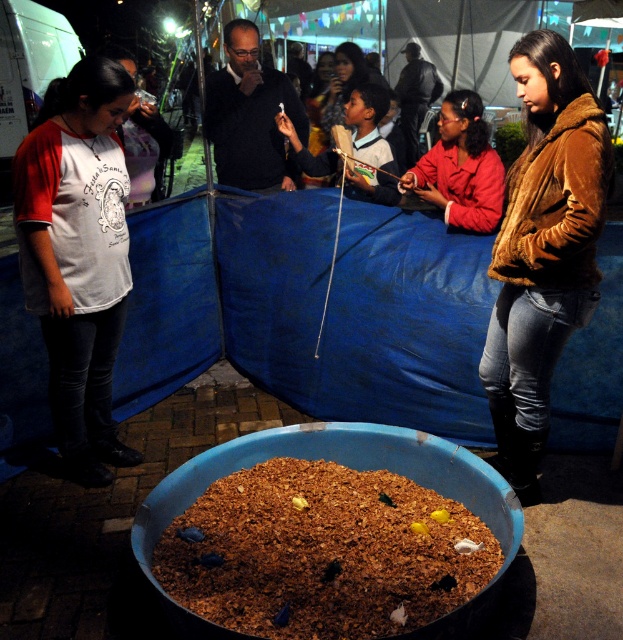
Is the position of brown crumbly food at center less distant than that of white jersey at left?

Yes, it is in front of white jersey at left.

Who is taller, brown crumbly food at center or white jersey at left?

With more height is white jersey at left.

Describe the element at coordinates (321, 552) in the screenshot. The height and width of the screenshot is (640, 623). I see `brown crumbly food at center` at that location.

This screenshot has height=640, width=623. In order to click on brown crumbly food at center in this screenshot , I will do `click(321, 552)`.

Is brown fuzzy jacket at lower right shorter than matte brown jacket at center?

Incorrect, brown fuzzy jacket at lower right's height does not fall short of matte brown jacket at center's.

Is brown fuzzy jacket at lower right smaller than matte brown jacket at center?

Yes, brown fuzzy jacket at lower right is smaller than matte brown jacket at center.

Does point (554, 140) come behind point (335, 51)?

No.

The width and height of the screenshot is (623, 640). Identify the location of brown fuzzy jacket at lower right. (543, 250).

Between brown crumbly food at center and brown fuzzy jacket at lower right, which one appears on the left side from the viewer's perspective?

brown crumbly food at center

Who is lower down, brown crumbly food at center or brown fuzzy jacket at lower right?

Positioned lower is brown crumbly food at center.

Where is `brown crumbly food at center`? The height and width of the screenshot is (640, 623). brown crumbly food at center is located at coordinates (321, 552).

Image resolution: width=623 pixels, height=640 pixels. Identify the location of brown crumbly food at center. (321, 552).